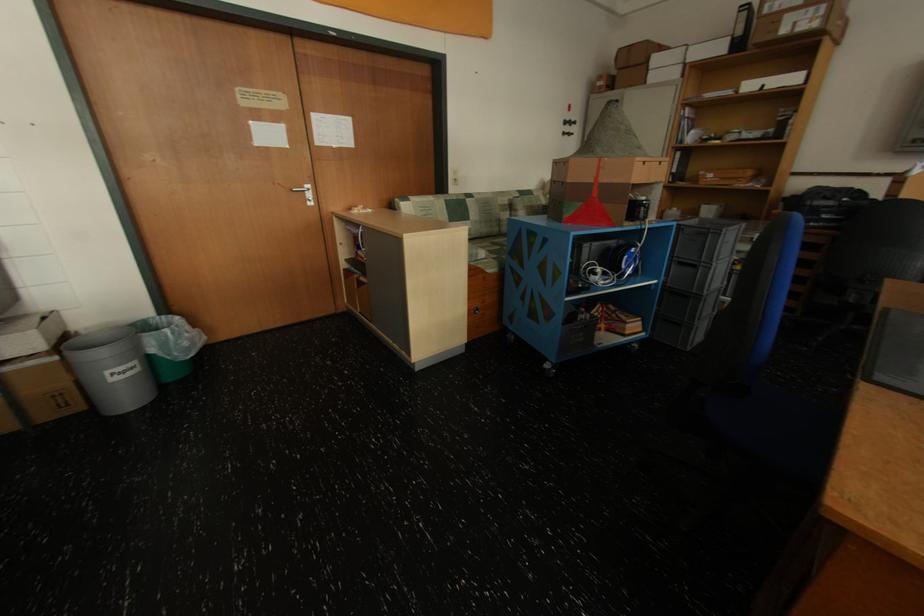
Where would you lift the grey paper bin? Please return your answer as a coordinate pair (x, y).

(111, 369)